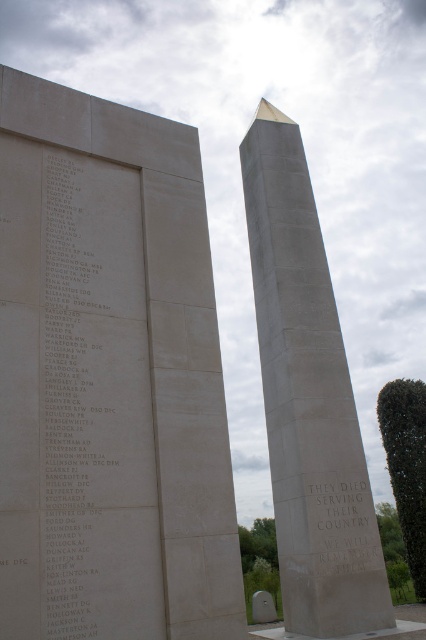
In the scene shown: You are an architect designing a new memorial. You need to place a statue between the matte stone memorial at center and the white stone obelisk at center. Which side should the statue be placed on to ensure it fits within the available space?

The matte stone memorial at center is narrower than the white stone obelisk at center. Therefore, placing the statue next to the matte stone memorial at center would provide more space for the statue to fit comfortably.

Based on the photo, what is located at the coordinates point (109,378) in the image?

The point (109,378) is occupied by the matte stone memorial at center.